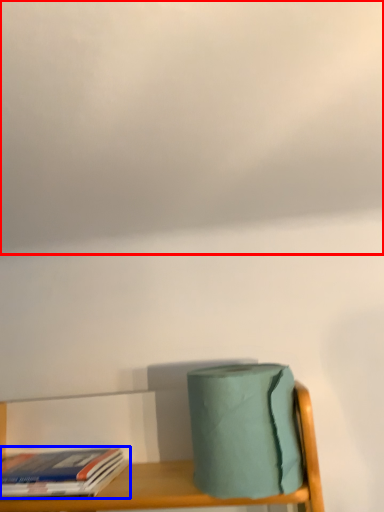
Question: Among these objects, which one is farthest to the camera, cloud (highlighted by a red box) or book (highlighted by a blue box)?

Choices:
 (A) cloud
 (B) book

Answer: (B)